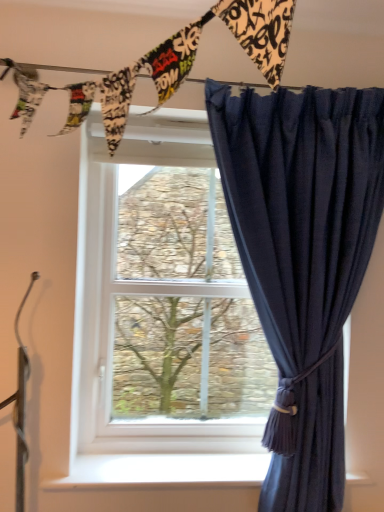
Question: Can you confirm if white smooth window sill at lower center is smaller than white plastic window at center?

Choices:
 (A) no
 (B) yes

Answer: (B)

Question: Is white smooth window sill at lower center closer to the viewer compared to white plastic window at center?

Choices:
 (A) no
 (B) yes

Answer: (B)

Question: Is white smooth window sill at lower center positioned with its back to white plastic window at center?

Choices:
 (A) no
 (B) yes

Answer: (A)

Question: Considering the relative sizes of white smooth window sill at lower center and white plastic window at center in the image provided, is white smooth window sill at lower center bigger than white plastic window at center?

Choices:
 (A) yes
 (B) no

Answer: (B)

Question: Considering the relative sizes of white smooth window sill at lower center and white plastic window at center in the image provided, is white smooth window sill at lower center wider than white plastic window at center?

Choices:
 (A) yes
 (B) no

Answer: (A)

Question: Considering the positions of navy blue sheer curtain at right and white plastic window at center in the image, is navy blue sheer curtain at right wider or thinner than white plastic window at center?

Choices:
 (A) thin
 (B) wide

Answer: (B)

Question: Based on their positions, is navy blue sheer curtain at right located to the left or right of white plastic window at center?

Choices:
 (A) left
 (B) right

Answer: (B)

Question: Relative to white plastic window at center, is navy blue sheer curtain at right in front or behind?

Choices:
 (A) behind
 (B) front

Answer: (B)

Question: Do you think navy blue sheer curtain at right is within white plastic window at center, or outside of it?

Choices:
 (A) inside
 (B) outside

Answer: (B)

Question: From a real-world perspective, relative to white smooth window sill at lower center, is white plastic window at center vertically above or below?

Choices:
 (A) below
 (B) above

Answer: (B)

Question: Based on their sizes in the image, would you say white plastic window at center is bigger or smaller than white smooth window sill at lower center?

Choices:
 (A) small
 (B) big

Answer: (B)

Question: Is white plastic window at center taller or shorter than white smooth window sill at lower center?

Choices:
 (A) tall
 (B) short

Answer: (A)

Question: Relative to white smooth window sill at lower center, is white plastic window at center in front or behind?

Choices:
 (A) front
 (B) behind

Answer: (B)

Question: From a real-world perspective, is white plastic window at center above or below navy blue sheer curtain at right?

Choices:
 (A) above
 (B) below

Answer: (A)

Question: From the image's perspective, is white plastic window at center positioned above or below navy blue sheer curtain at right?

Choices:
 (A) below
 (B) above

Answer: (B)